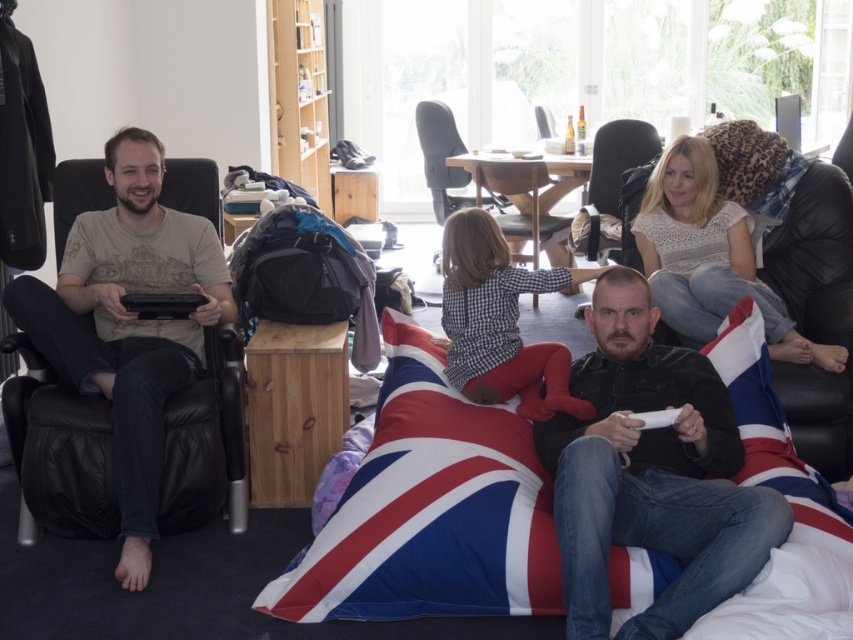
Between leopard print scarf at upper right and checkered shirt at center, which one appears on the left side from the viewer's perspective?

checkered shirt at center is more to the left.

Does leopard print scarf at upper right come in front of checkered shirt at center?

No, leopard print scarf at upper right is further to the viewer.

Find the location of a particular element. leopard print scarf at upper right is located at coordinates (709, 257).

Does point (679, 330) lie behind point (733, 339)?

That is True.

Which is more to the right, leopard print scarf at upper right or union jack fabric at lower center?

From the viewer's perspective, union jack fabric at lower center appears more on the right side.

What do you see at coordinates (709, 257) in the screenshot?
I see `leopard print scarf at upper right` at bounding box center [709, 257].

You are a GUI agent. You are given a task and a screenshot of the screen. Output one action in this format:
    pyautogui.click(x=<x>, y=<y>)
    Task: Click on the leopard print scarf at upper right
    This screenshot has height=640, width=853.
    Given the screenshot: What is the action you would take?
    pyautogui.click(x=709, y=257)

Is black leather chair at upper right positioned at the back of matte gray office chair at center?

No, black leather chair at upper right is in front of matte gray office chair at center.

Does black leather chair at upper right have a lesser height compared to matte gray office chair at center?

Indeed, black leather chair at upper right has a lesser height compared to matte gray office chair at center.

Where is `black leather chair at upper right`? This screenshot has width=853, height=640. black leather chair at upper right is located at coordinates (618, 161).